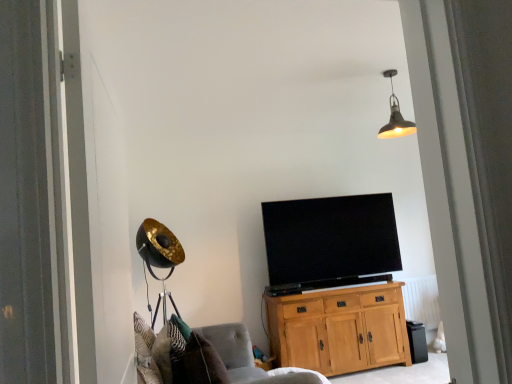
Question: From the image's perspective, does light oak cabinet at center appear higher than black plastic trash bin at lower right?

Choices:
 (A) no
 (B) yes

Answer: (B)

Question: Is light oak cabinet at center at the left side of black plastic trash bin at lower right?

Choices:
 (A) yes
 (B) no

Answer: (A)

Question: Is light oak cabinet at center thinner than black plastic trash bin at lower right?

Choices:
 (A) no
 (B) yes

Answer: (A)

Question: Is light oak cabinet at center outside of black plastic trash bin at lower right?

Choices:
 (A) no
 (B) yes

Answer: (B)

Question: Is the position of light oak cabinet at center more distant than that of black plastic trash bin at lower right?

Choices:
 (A) yes
 (B) no

Answer: (B)

Question: Is point (368, 288) positioned closer to the camera than point (174, 382)?

Choices:
 (A) farther
 (B) closer

Answer: (A)

Question: In the image, is light oak cabinet at center positioned in front of or behind patterned fabric pillow at lower left?

Choices:
 (A) front
 (B) behind

Answer: (B)

Question: From the image's perspective, is light oak cabinet at center positioned above or below patterned fabric pillow at lower left?

Choices:
 (A) below
 (B) above

Answer: (A)

Question: Looking at the image, does light oak cabinet at center seem bigger or smaller compared to patterned fabric pillow at lower left?

Choices:
 (A) small
 (B) big

Answer: (B)

Question: Does point (179, 317) appear closer or farther from the camera than point (407, 301)?

Choices:
 (A) farther
 (B) closer

Answer: (B)

Question: In terms of width, does patterned fabric pillow at lower left look wider or thinner when compared to white painted radiator at lower right?

Choices:
 (A) wide
 (B) thin

Answer: (A)

Question: Considering the positions of patterned fabric pillow at lower left and white painted radiator at lower right in the image, is patterned fabric pillow at lower left taller or shorter than white painted radiator at lower right?

Choices:
 (A) short
 (B) tall

Answer: (A)

Question: From a real-world perspective, is patterned fabric pillow at lower left above or below white painted radiator at lower right?

Choices:
 (A) below
 (B) above

Answer: (B)

Question: From the image's perspective, is black plastic trash bin at lower right above or below metallic pendant light at upper center?

Choices:
 (A) below
 (B) above

Answer: (A)

Question: Would you say black plastic trash bin at lower right is inside or outside metallic pendant light at upper center?

Choices:
 (A) inside
 (B) outside

Answer: (B)